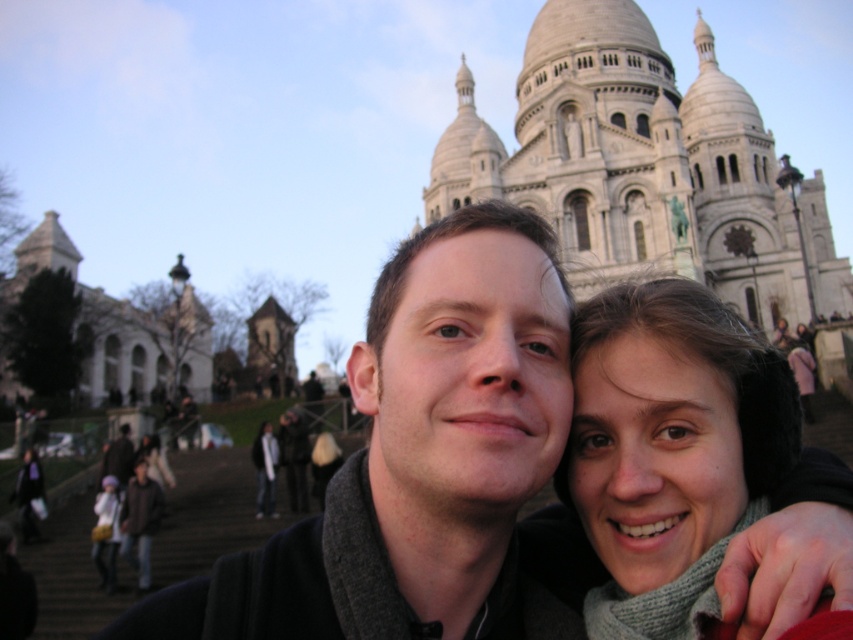
Question: Which object appears closest to the camera in this image?

Choices:
 (A) gray knitted scarf at center
 (B) matte black jacket at center

Answer: (B)

Question: Does matte black jacket at center appear on the right side of gray knitted scarf at center?

Choices:
 (A) yes
 (B) no

Answer: (B)

Question: Which object appears closest to the camera in this image?

Choices:
 (A) matte black jacket at center
 (B) matte gray scarf at lower center

Answer: (A)

Question: Among these points, which one is nearest to the camera?

Choices:
 (A) (259, 493)
 (B) (656, 436)

Answer: (B)

Question: Is matte black jacket at center smaller than matte gray scarf at lower center?

Choices:
 (A) no
 (B) yes

Answer: (A)

Question: Can you confirm if matte black jacket at center is positioned to the right of gray knitted scarf at center?

Choices:
 (A) no
 (B) yes

Answer: (A)